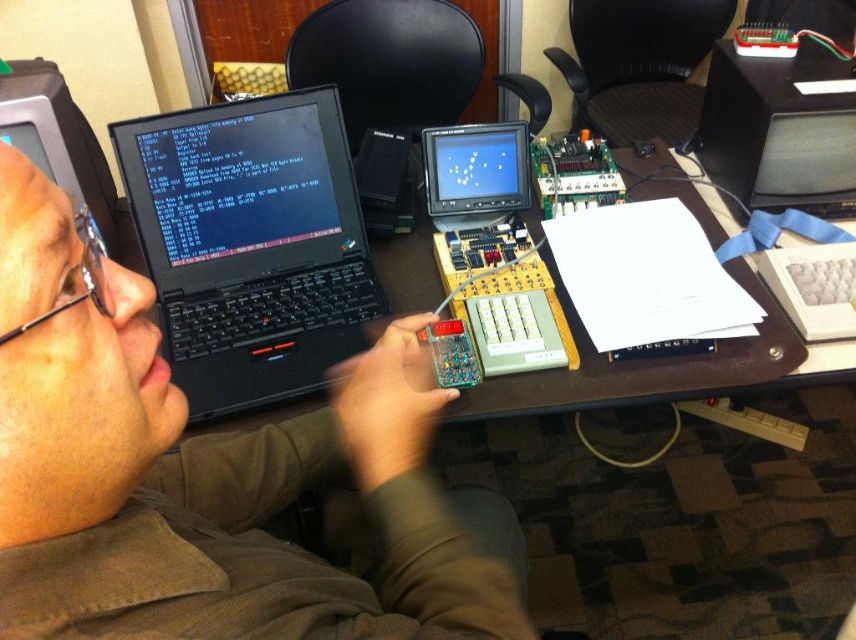
Is matte black laptop at upper left wider than black plastic monitor at upper right?

Correct, the width of matte black laptop at upper left exceeds that of black plastic monitor at upper right.

Is the position of matte black laptop at upper left less distant than that of black plastic monitor at upper right?

Yes.

Between point (420, 589) and point (785, 189), which one is positioned in front?

Point (420, 589) is in front.

Image resolution: width=856 pixels, height=640 pixels. What are the coordinates of `matte black laptop at upper left` in the screenshot? It's located at (201, 474).

Is matte black laptop at upper left above brown wooden table at center?

No.

Is point (100, 563) farther from camera compared to point (847, 374)?

No.

The width and height of the screenshot is (856, 640). Find the location of `matte black laptop at upper left`. matte black laptop at upper left is located at coordinates (201, 474).

Which is more to the left, black matte laptop at center or brown wooden table at center?

black matte laptop at center is more to the left.

Is point (155, 145) positioned in front of point (580, 400)?

No.

Locate an element on the screen. The width and height of the screenshot is (856, 640). black matte laptop at center is located at coordinates (250, 244).